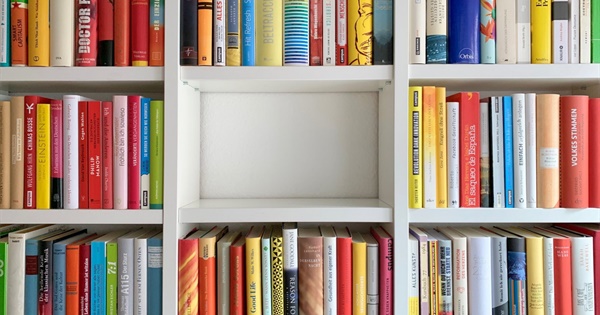
The height and width of the screenshot is (315, 600). Identify the location of blue books. (99, 285), (144, 144), (468, 27), (511, 157).